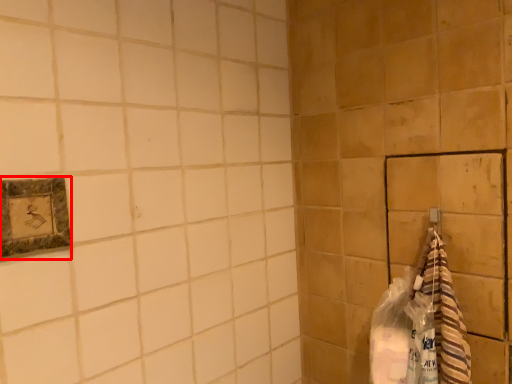
Question: Considering the relative positions of picture frame (annotated by the red box) and material in the image provided, where is picture frame (annotated by the red box) located with respect to the staircase?

Choices:
 (A) left
 (B) right

Answer: (A)